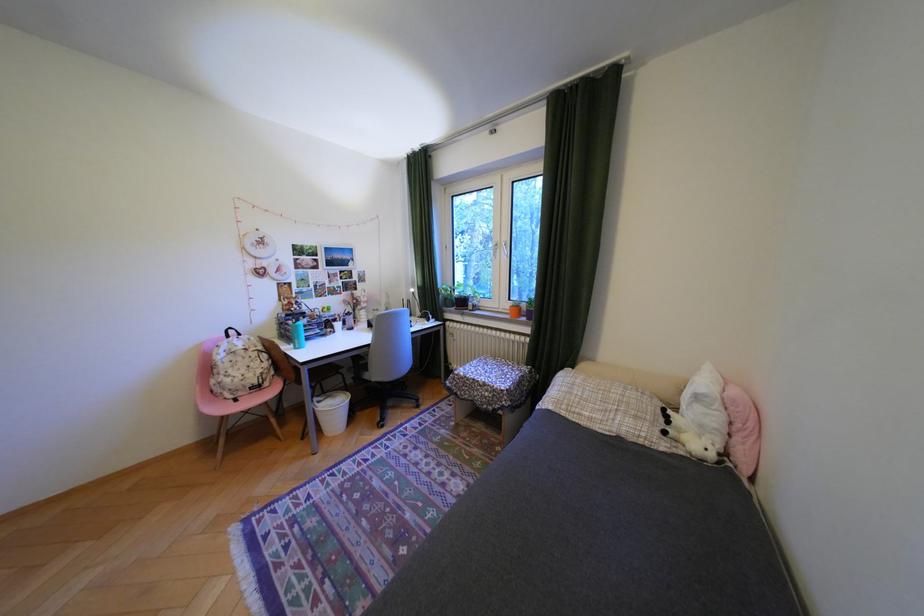
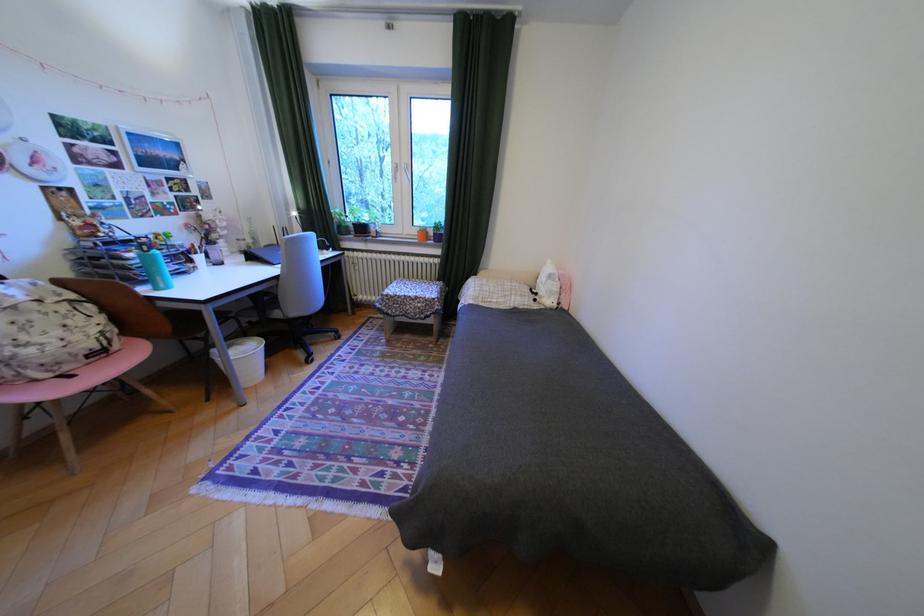
Locate, in the second image, the point that corresponds to point 251,359 in the first image.

(49, 317)